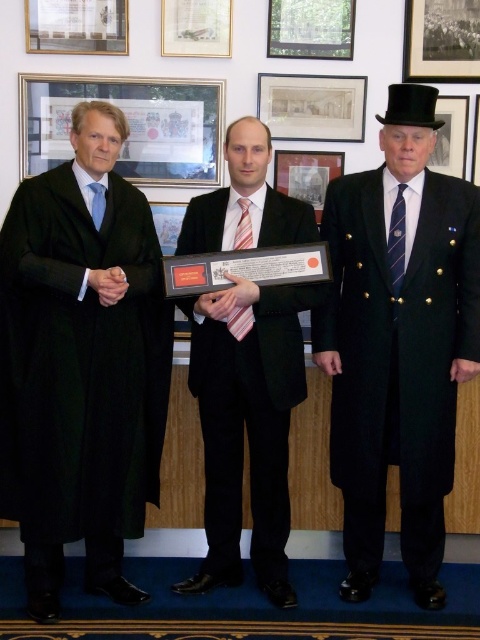
You are an interior designer assessing the layout of this room. The black woolen robe at left and the matte glass picture frame at upper left are both in view. Which object occupies more horizontal space in the scene?

The matte glass picture frame at upper left occupies more horizontal space because the black woolen robe at left has a lesser width compared to it.

Based on the coordinates provided, which object corresponds to the point at (82, 364)?

The point at (82, 364) corresponds to the black woolen robe at left.

You are a photographer preparing to take a group photo of the three men. You need to ensure that both the black wool coat at right and the black satin suit at center are fully visible in the frame. Given their height difference, which man should stand closer to the camera to avoid blocking the other?

The black wool coat at right is much taller than the black satin suit at center. To ensure both are fully visible, the shorter black satin suit at center should stand closer to the camera so that the taller black wool coat at right doesn